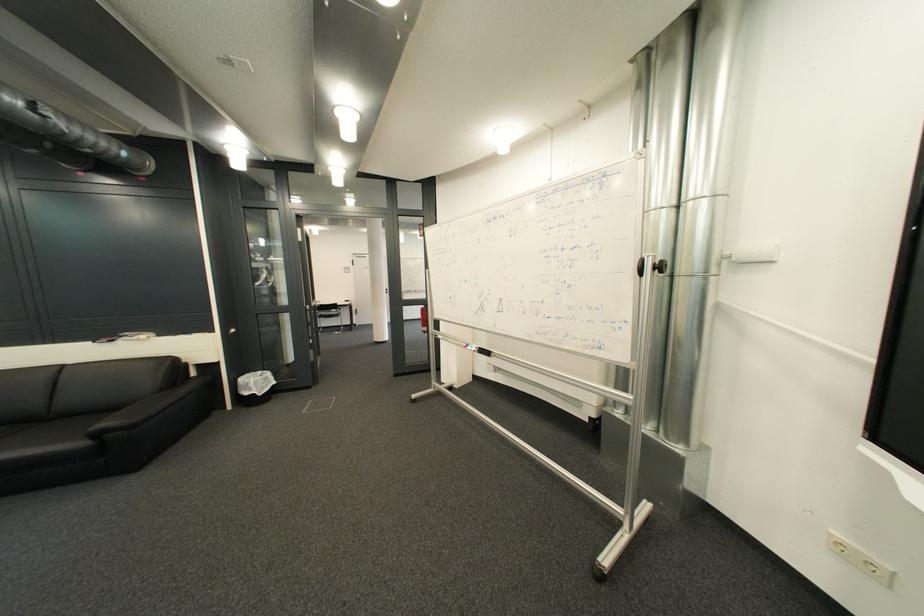
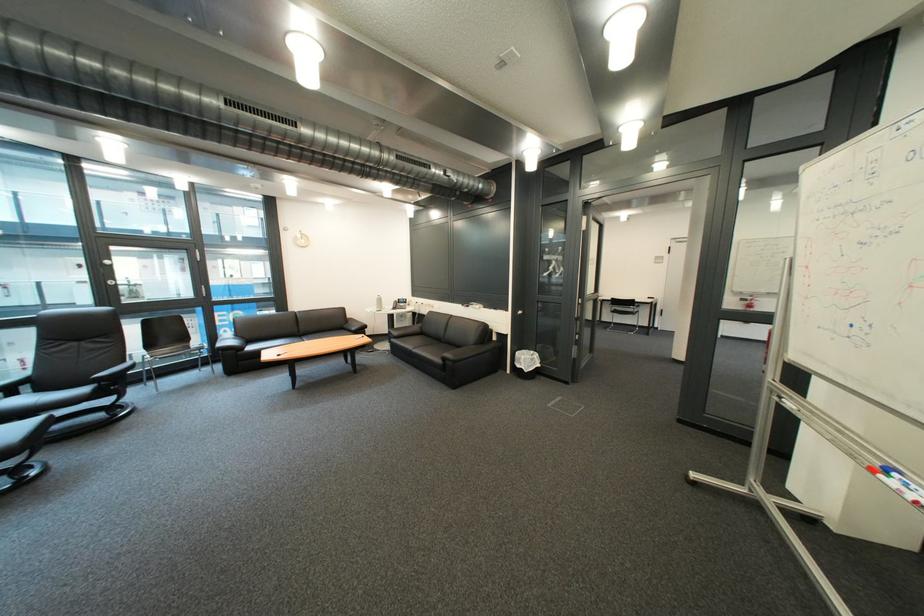
Find the pixel in the second image that matches pixel 336 330 in the first image.

(628, 325)